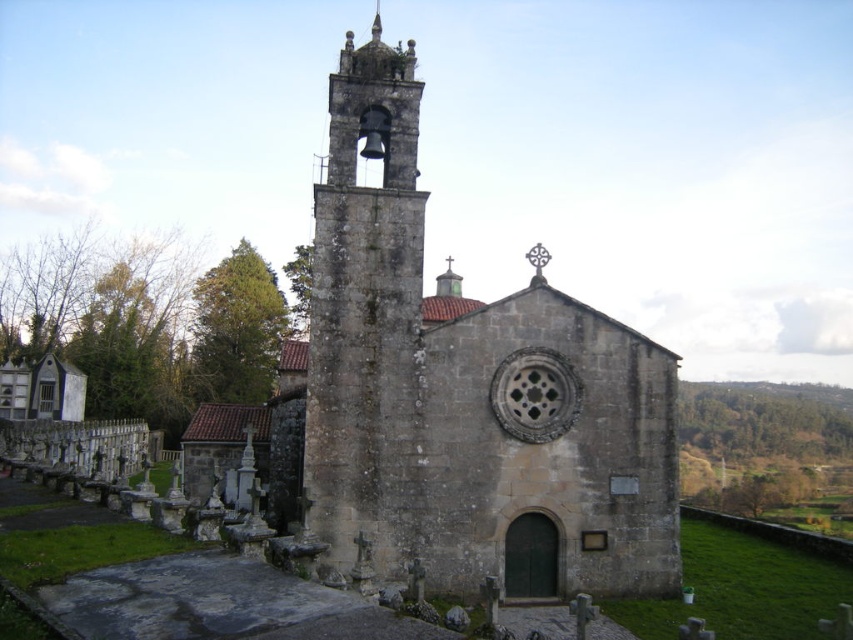
You are standing in front of the historic stone church with a bell tower. If you were to draw a map of the area, where would you place the stone church at center relative to the other landmarks? Please provide coordinates based on the image.

The stone church at center is located at coordinates point (460, 396) according to the image.

You are an architect analyzing the structure of the stone church at center and the stone bell tower at center. Based on their sizes, which one do you think is more likely to require additional structural support to withstand strong winds?

The stone bell tower at center is larger and therefore may require more structural support to withstand strong winds compared to the stone church at center.

You are standing in front of the historic stone church and want to take a photo. There are two points on the church facade marked as point 1 at coordinates [341,74] and point 2 at [405,320]. If you focus your camera on point 2, will point 1 be closer to or farther from the camera compared to point 2?

Point 1 at coordinates [341,74] is further to the camera than point 2 at [405,320]. Therefore, when focusing on point 2, point 1 will appear farther away from the camera compared to point 2.